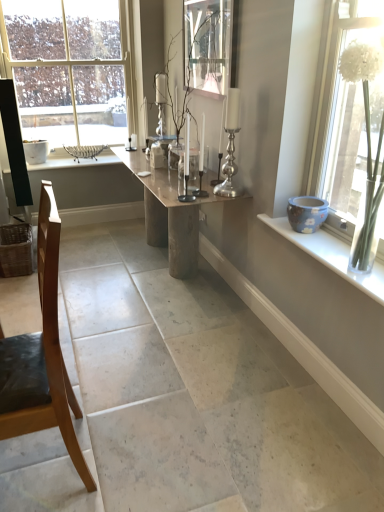
Identify the location of free space between light wood chair at left and natural wood table at center. (127, 329).